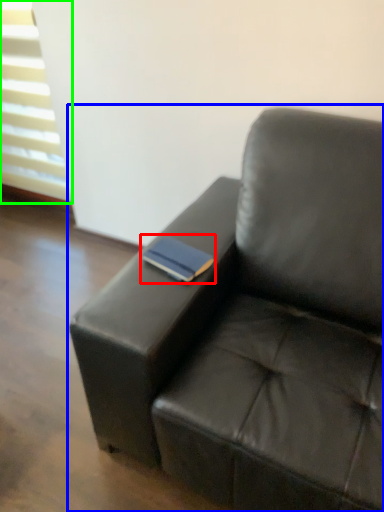
Question: Based on their relative distances, which object is farther from paperback book (highlighted by a red box)? Choose from studio couch (highlighted by a blue box) and window (highlighted by a green box).

Choices:
 (A) studio couch
 (B) window

Answer: (B)